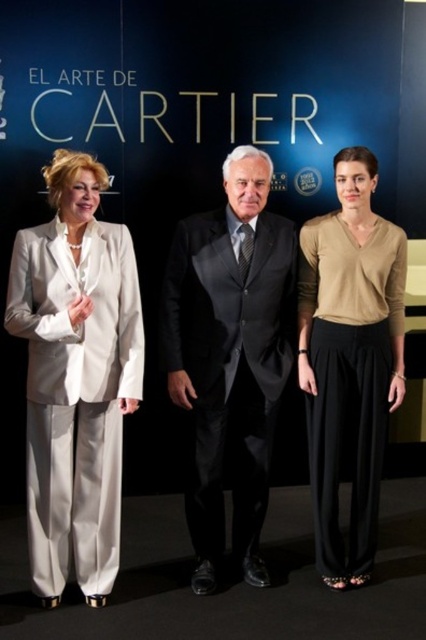
Which of these two, matte white suit at left or beige soft sweater at center, stands taller?

With more height is beige soft sweater at center.

Which is behind, point (71, 497) or point (374, 380)?

The point (374, 380) is behind.

Locate an element on the screen. Image resolution: width=426 pixels, height=640 pixels. matte white suit at left is located at coordinates (75, 376).

Can you confirm if matte white suit at left is shorter than dark gray suit at center?

Yes, matte white suit at left is shorter than dark gray suit at center.

What do you see at coordinates (75, 376) in the screenshot? The width and height of the screenshot is (426, 640). I see `matte white suit at left` at bounding box center [75, 376].

Between point (71, 458) and point (259, 177), which one is positioned in front?

Positioned in front is point (259, 177).

Image resolution: width=426 pixels, height=640 pixels. Find the location of `matte white suit at left`. matte white suit at left is located at coordinates (75, 376).

Does dark gray suit at center have a smaller size compared to beige soft sweater at center?

No, dark gray suit at center is not smaller than beige soft sweater at center.

What do you see at coordinates (230, 356) in the screenshot? The height and width of the screenshot is (640, 426). I see `dark gray suit at center` at bounding box center [230, 356].

Which is behind, point (236, 161) or point (317, 500)?

Point (317, 500)

Find the location of a particular element. Image resolution: width=426 pixels, height=640 pixels. dark gray suit at center is located at coordinates (230, 356).